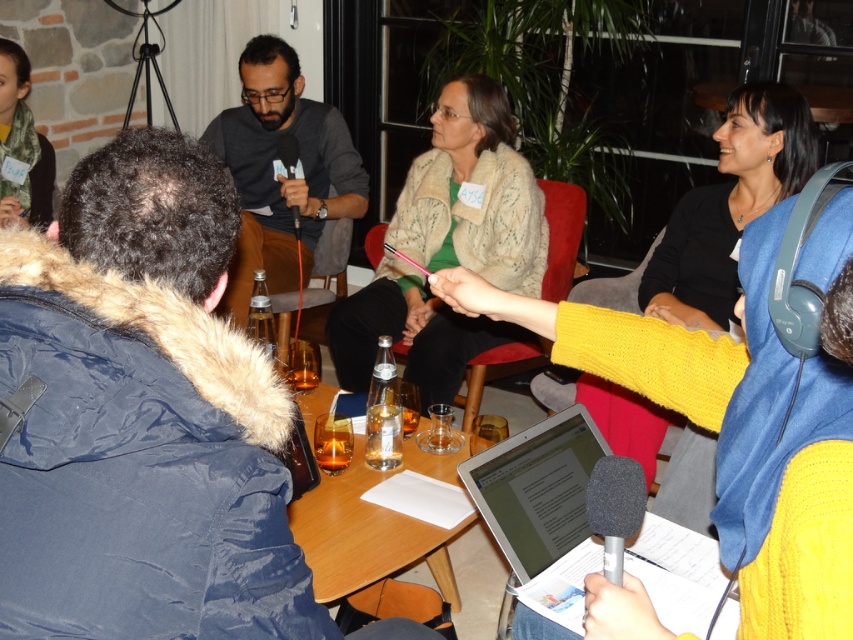
Does silver metallic laptop at center have a lesser height compared to black matte microphone at center?

No, silver metallic laptop at center is not shorter than black matte microphone at center.

Where is `silver metallic laptop at center`? silver metallic laptop at center is located at coordinates (543, 509).

Does point (585, 513) come closer to viewer compared to point (403, 417)?

Yes.

In the scene shown: Who is positioned more to the left, black foam microphone at lower right or clear glass bottle at center?

From the viewer's perspective, clear glass bottle at center appears more on the left side.

Between point (610, 548) and point (410, 419), which one is positioned behind?

Point (410, 419)

At what (x,y) coordinates should I click in order to perform the action: click on black foam microphone at lower right. Please return your answer as a coordinate pair (x, y). The height and width of the screenshot is (640, 853). Looking at the image, I should click on (614, 508).

Between point (419, 228) and point (614, 566), which one is positioned in front?

Point (614, 566)

Is fuzzy white coat at center bigger than black foam microphone at lower right?

Indeed, fuzzy white coat at center has a larger size compared to black foam microphone at lower right.

Measure the distance between point (415, 280) and camera.

A distance of 10.05 feet exists between point (415, 280) and camera.

Image resolution: width=853 pixels, height=640 pixels. Identify the location of fuzzy white coat at center. (473, 193).